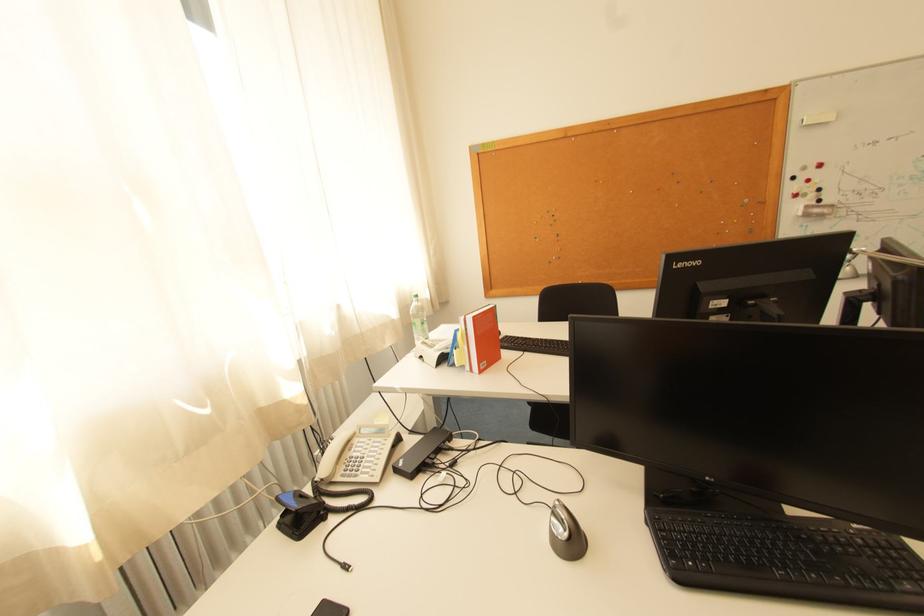
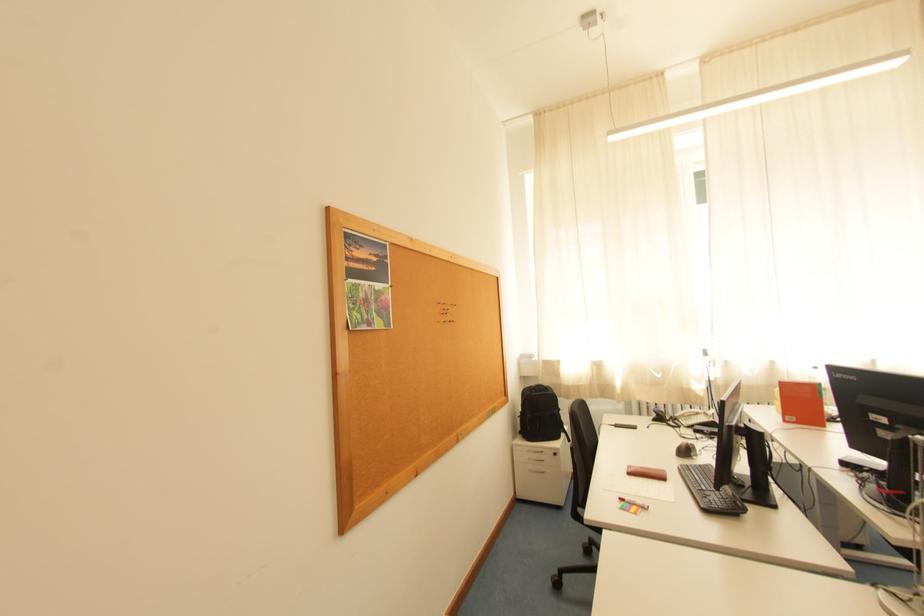
Locate, in the second image, the point that corresponds to [356,456] in the first image.

(699, 418)